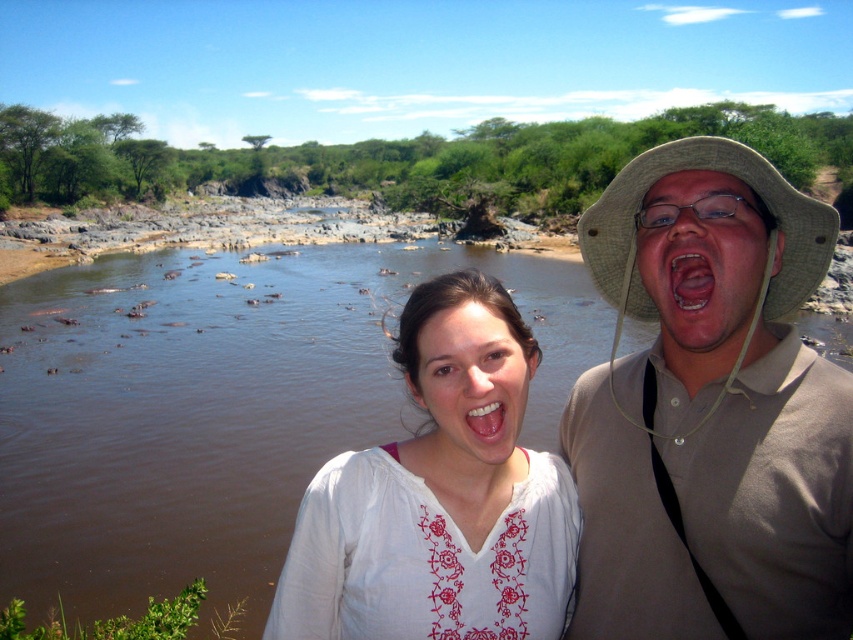
Question: Based on their relative distances, which object is nearer to the brown muddy water at center?

Choices:
 (A) white fabric face at center
 (B) white embroidered shirt at center

Answer: (A)

Question: Which point appears closest to the camera in this image?

Choices:
 (A) (775, 186)
 (B) (556, 406)
 (C) (480, 412)

Answer: (A)

Question: Where is white embroidered shirt at center located in relation to pink flesh at center in the image?

Choices:
 (A) right
 (B) left

Answer: (B)

Question: Does tan woven hat at upper right lie behind bright white teeth at center?

Choices:
 (A) yes
 (B) no

Answer: (B)

Question: Among these points, which one is farthest from the camera?

Choices:
 (A) (444, 632)
 (B) (670, 282)

Answer: (A)

Question: Where is white embroidered shirt at center located in relation to bright white teeth at center in the image?

Choices:
 (A) above
 (B) below

Answer: (B)